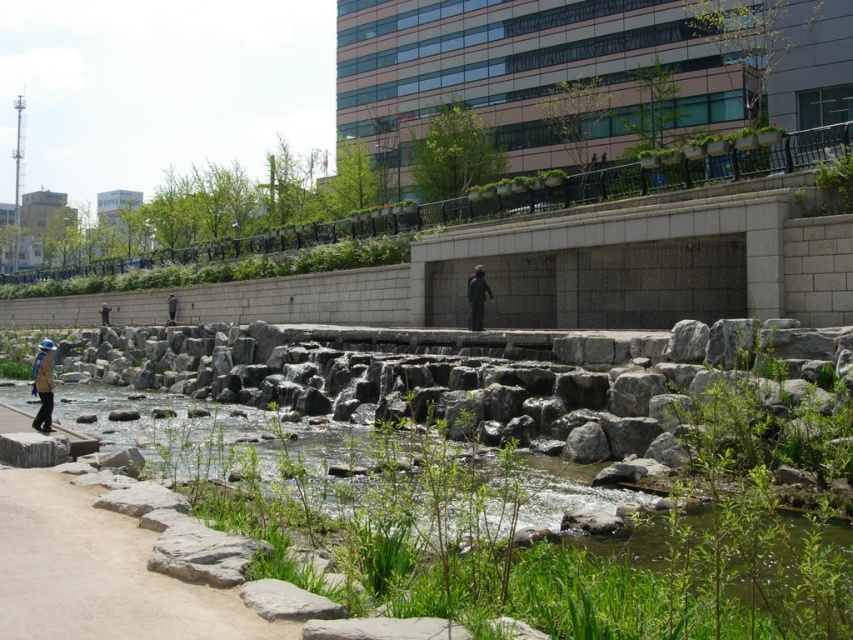
Based on the photo, can you confirm if blue fabric hat at left is positioned to the right of dark gray concrete person at center?

Incorrect, blue fabric hat at left is not on the right side of dark gray concrete person at center.

In the scene shown: Can you confirm if blue fabric hat at left is shorter than dark gray concrete person at center?

No, blue fabric hat at left is not shorter than dark gray concrete person at center.

Is point (50, 365) behind point (170, 298)?

No, it is not.

Image resolution: width=853 pixels, height=640 pixels. In order to click on blue fabric hat at left in this screenshot , I will do `click(44, 387)`.

Is green grassy waterway at lower left smaller than dark gray suit at center?

No.

Does point (581, 579) come closer to viewer compared to point (469, 308)?

That is True.

Does point (309, 467) come in front of point (480, 294)?

Yes, it is in front of point (480, 294).

Where is `green grassy waterway at lower left`? Image resolution: width=853 pixels, height=640 pixels. green grassy waterway at lower left is located at coordinates (503, 531).

Can you confirm if green grassy waterway at lower left is positioned above sandy beige path at lower left?

No, green grassy waterway at lower left is not above sandy beige path at lower left.

Does green grassy waterway at lower left have a greater width compared to sandy beige path at lower left?

Indeed, green grassy waterway at lower left has a greater width compared to sandy beige path at lower left.

Locate an element on the screen. green grassy waterway at lower left is located at coordinates (503, 531).